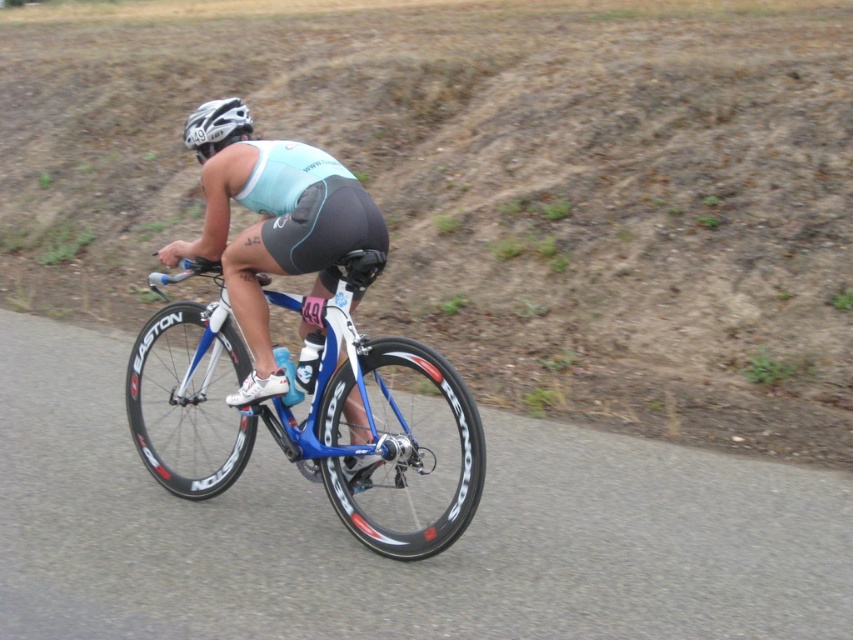
Question: Is blue metallic bicycle at center smaller than white matte helmet at upper center?

Choices:
 (A) yes
 (B) no

Answer: (B)

Question: Does blue metallic bicycle at center appear on the left side of white matte helmet at upper center?

Choices:
 (A) no
 (B) yes

Answer: (B)

Question: Observing the image, what is the correct spatial positioning of blue metallic bicycle at center in reference to white matte helmet at upper center?

Choices:
 (A) below
 (B) above

Answer: (A)

Question: Which point is closer to the camera taking this photo?

Choices:
 (A) (192, 150)
 (B) (444, 390)

Answer: (B)